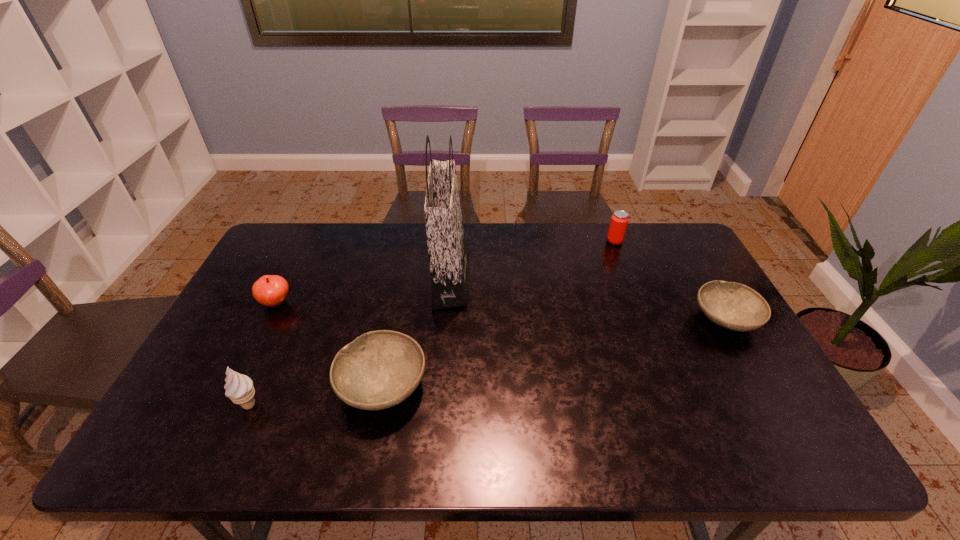
Where is `unoccupied position between the shopping bag and the right bowl`? This screenshot has height=540, width=960. unoccupied position between the shopping bag and the right bowl is located at coordinates (588, 299).

Locate an element on the screen. The image size is (960, 540). vacant space in between the fifth shortest object and the farthest object is located at coordinates (432, 323).

I want to click on empty space between the icecream and the tallest object, so click(350, 342).

Identify the location of empty location between the farthest object and the second shortest object. (498, 314).

Where is `free space between the nearer bowl and the fifth object from left to right`? This screenshot has height=540, width=960. free space between the nearer bowl and the fifth object from left to right is located at coordinates (498, 314).

At what (x,y) coordinates should I click in order to perform the action: click on vacant point located between the second shortest object and the shopping bag. Please return your answer as a coordinate pair (x, y). Image resolution: width=960 pixels, height=540 pixels. Looking at the image, I should click on (417, 333).

This screenshot has width=960, height=540. I want to click on empty location between the second shortest object and the beer can, so click(498, 314).

The width and height of the screenshot is (960, 540). I want to click on free point between the beer can and the taller bowl, so click(x=498, y=314).

Identify the location of blank region between the second shortest object and the icecream. The width and height of the screenshot is (960, 540). (316, 395).

Identify which object is the fourth nearest to the right bowl. Please provide its 2D coordinates. Your answer should be formatted as a tuple, i.e. [(x, y)], where the tuple contains the x and y coordinates of a point satisfying the conditions above.

[(239, 388)]